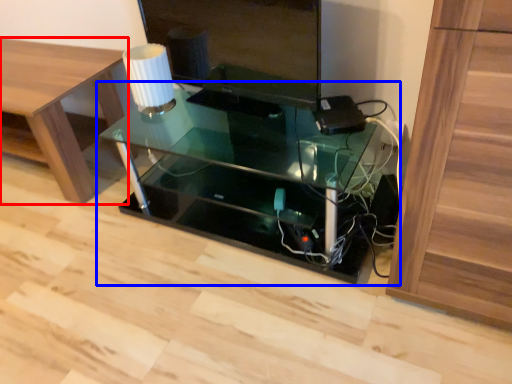
Question: Which point is further to the camera, furniture (highlighted by a red box) or table (highlighted by a blue box)?

Choices:
 (A) furniture
 (B) table

Answer: (A)